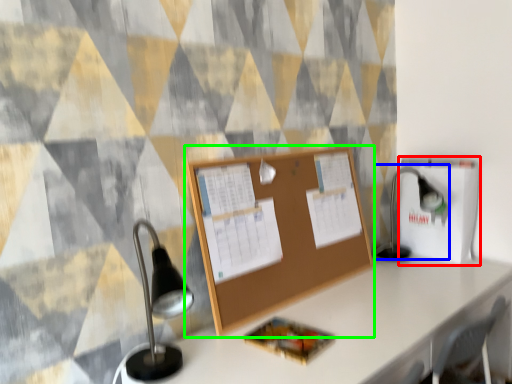
Question: Which object is the farthest from cardboard box (highlighted by a red box)? Choose among these: table lamp (highlighted by a blue box) or bulletin board (highlighted by a green box).

Choices:
 (A) table lamp
 (B) bulletin board

Answer: (B)